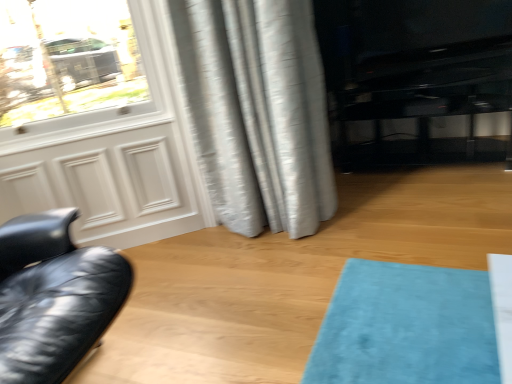
Question: In the image, is matte white screen door at left on the left side or the right side of silvery textured curtain at center?

Choices:
 (A) right
 (B) left

Answer: (B)

Question: Looking at the image, does matte white screen door at left seem bigger or smaller compared to silvery textured curtain at center?

Choices:
 (A) small
 (B) big

Answer: (A)

Question: Which object is positioned farthest from the silvery textured curtain at center?

Choices:
 (A) matte white screen door at left
 (B) black glossy entertainment center at right

Answer: (B)

Question: Based on their relative distances, which object is farther from the black glossy entertainment center at right?

Choices:
 (A) matte white screen door at left
 (B) silvery textured curtain at center

Answer: (A)